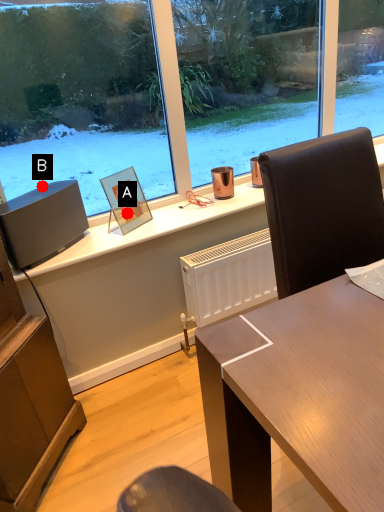
Question: Two points are circled on the image, labeled by A and B beside each circle. Among these points, which one is farthest from the camera?

Choices:
 (A) A is further
 (B) B is further

Answer: (A)